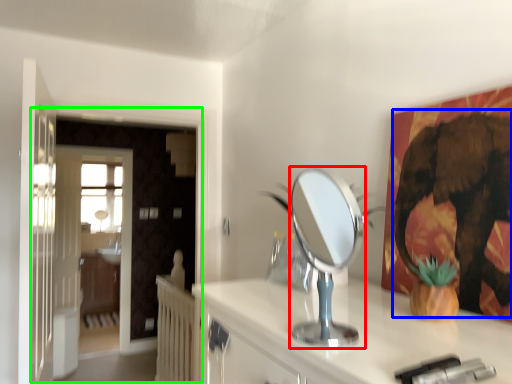
Question: Based on their relative distances, which object is nearer to mirror (highlighted by a red box)? Choose from elephant (highlighted by a blue box) and door (highlighted by a green box).

Choices:
 (A) elephant
 (B) door

Answer: (A)